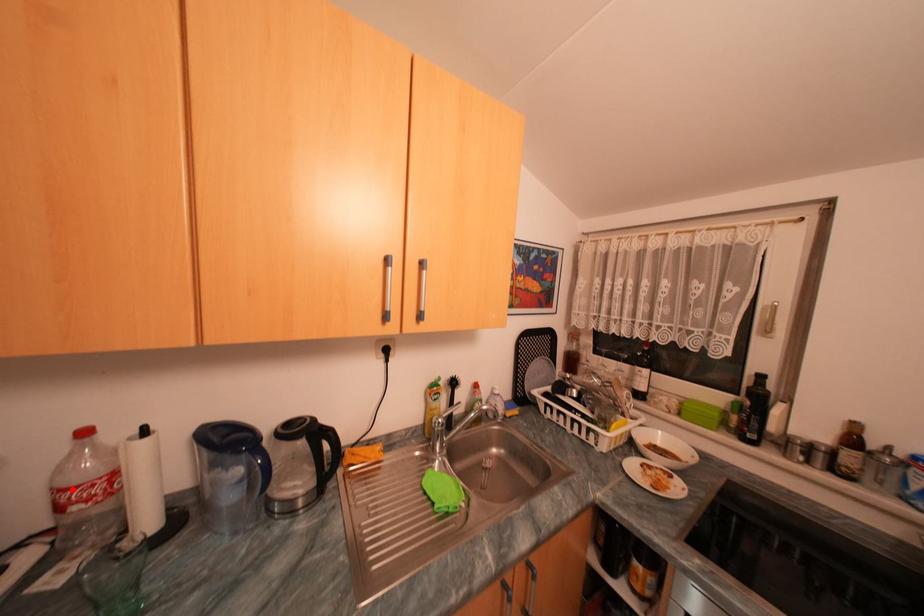
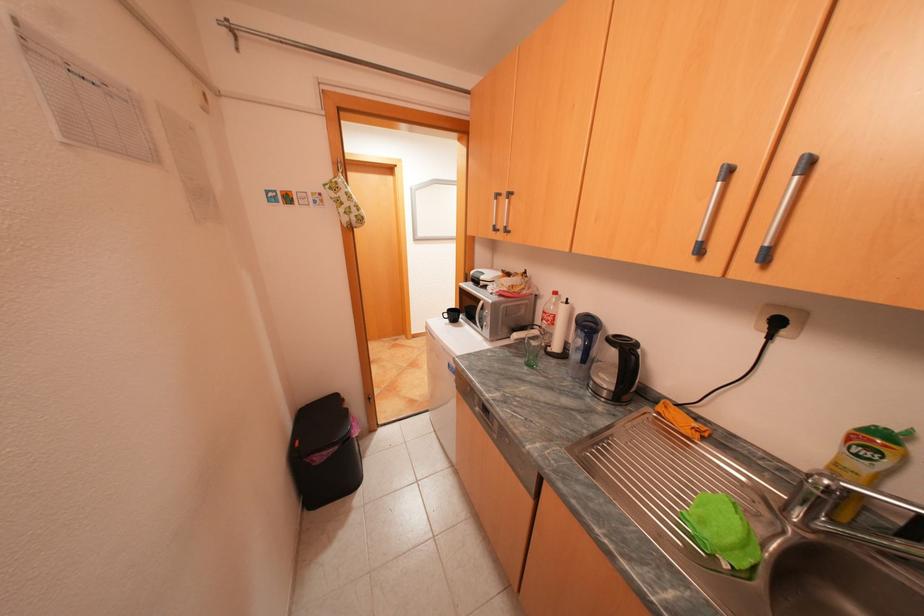
Where in the second image is the point corresponding to the highlighted location from the first image?

(553, 312)